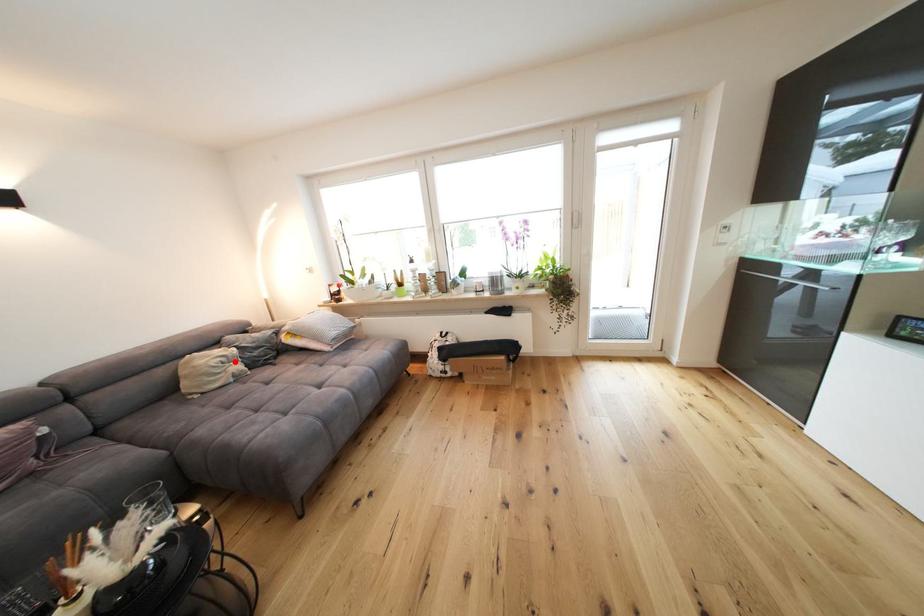
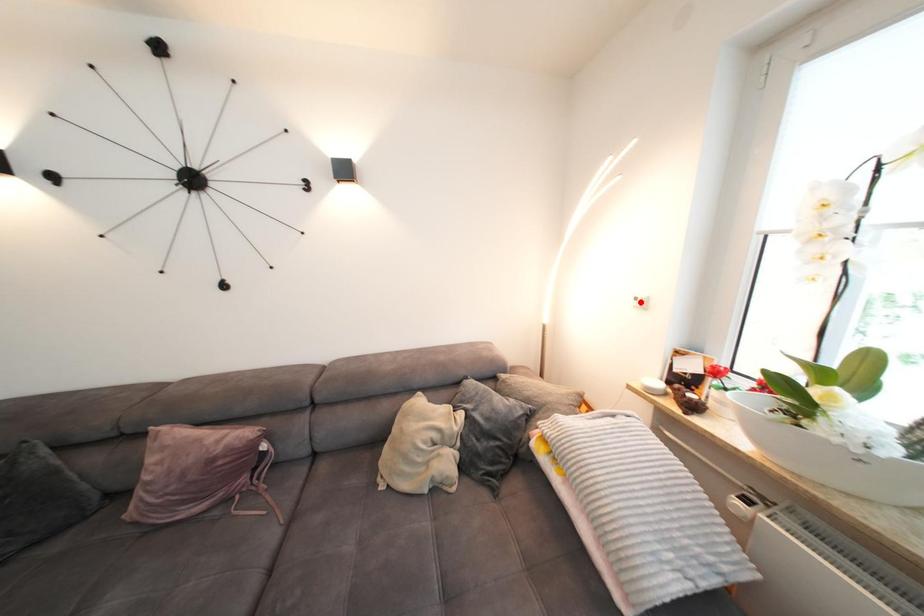
I am providing you with two images of the same scene from different viewpoints. A red point is marked on the first image and another point is marked on the second image. Are the points marked in image1 and image2 representing the same 3D position?

No